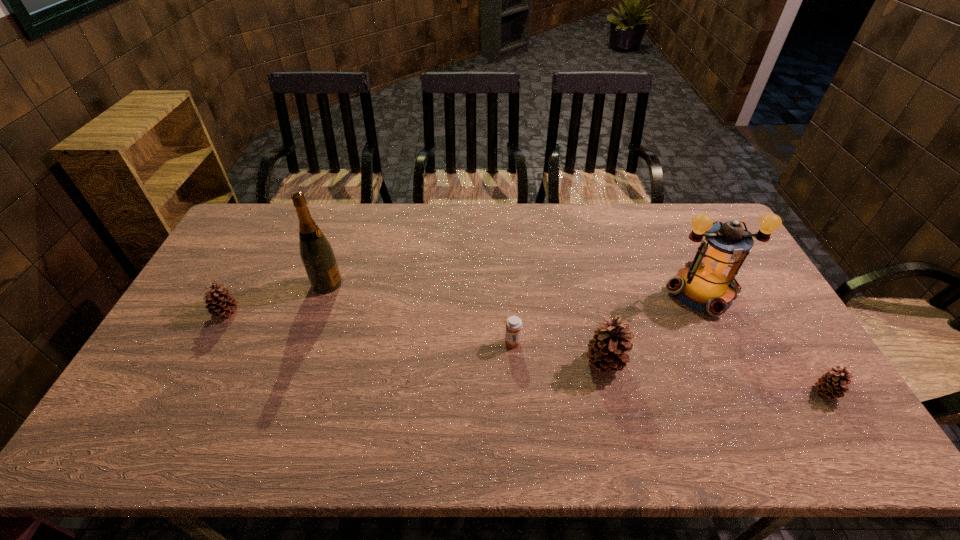
At what (x,y) coordinates should I click in order to perform the action: click on free location located 0.070m on the back of the leftmost pinecone. Please return your answer as a coordinate pair (x, y). This screenshot has height=540, width=960. Looking at the image, I should click on tap(241, 286).

At what (x,y) coordinates should I click in order to perform the action: click on vacant space located on the right of the fourth shortest object. Please return your answer as a coordinate pair (x, y). This screenshot has height=540, width=960. Looking at the image, I should click on (657, 363).

Locate an element on the screen. This screenshot has width=960, height=540. blank space located 0.300m on the back of the rightmost object is located at coordinates (767, 297).

At what (x,y) coordinates should I click in order to perform the action: click on vacant region located on the front-facing side of the lantern. Please return your answer as a coordinate pair (x, y). Looking at the image, I should click on (733, 357).

You are a GUI agent. You are given a task and a screenshot of the screen. Output one action in this format:
    pyautogui.click(x=<x>, y=<y>)
    Task: Click on the vacant space located 0.060m on the front-facing side of the fifth object from right to left
    Image resolution: width=960 pixels, height=540 pixels.
    Given the screenshot: What is the action you would take?
    pyautogui.click(x=361, y=284)

The width and height of the screenshot is (960, 540). I want to click on blank space located 0.210m on the back of the third object from left to right, so click(508, 282).

Find the location of a particular element. object that is at the left edge is located at coordinates (220, 303).

This screenshot has height=540, width=960. Identify the location of pinecone that is positioned at the right edge. (831, 384).

This screenshot has height=540, width=960. I want to click on lantern at the right edge, so click(707, 284).

Where is `object located at the near right corner`? object located at the near right corner is located at coordinates (831, 384).